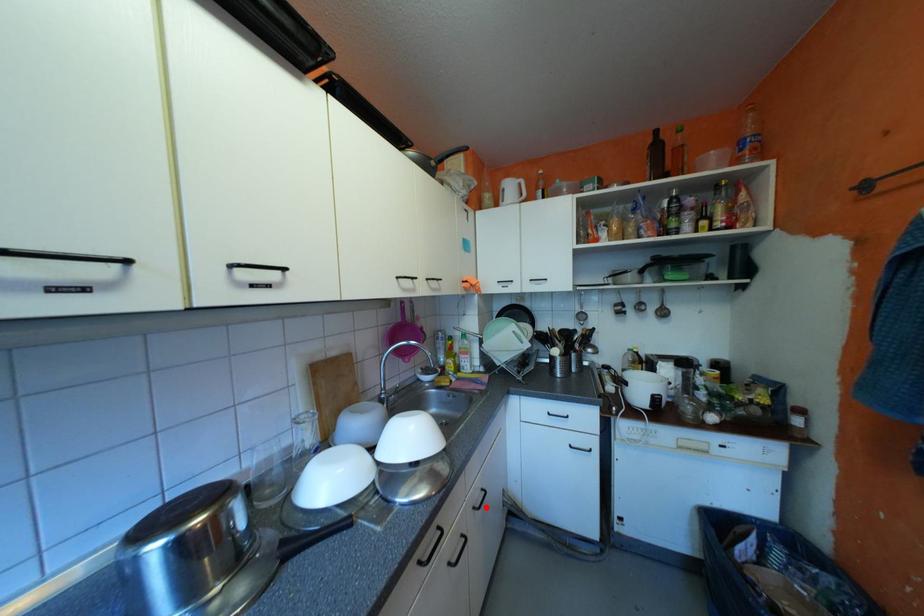
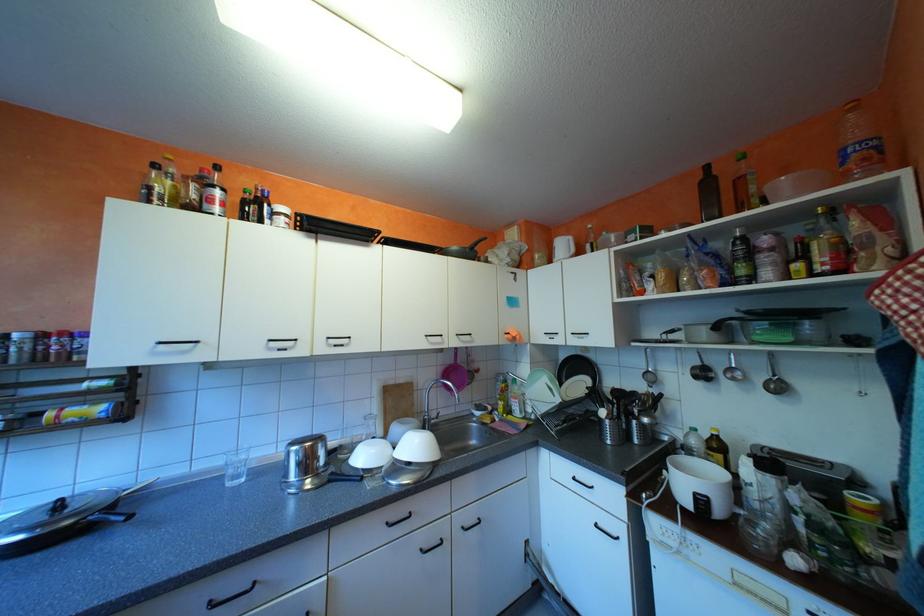
Question: I am providing you with two images of the same scene from different viewpoints. In image1, a red point is highlighted. Considering the same 3D point in image2, which of the following is correct?

Choices:
 (A) It is closer
 (B) It is farther

Answer: (B)